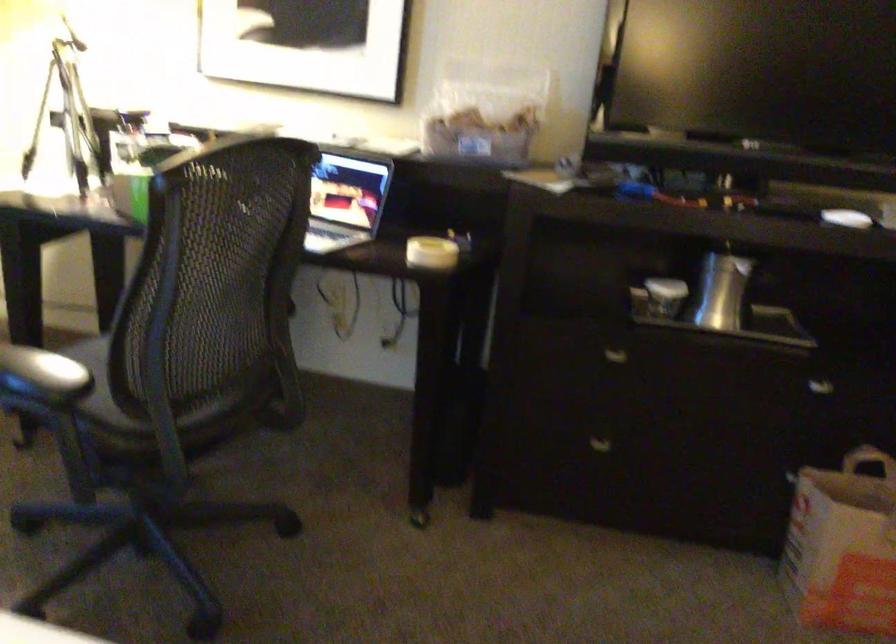
Where is `black chair sitting surface`? Image resolution: width=896 pixels, height=644 pixels. black chair sitting surface is located at coordinates (124, 346).